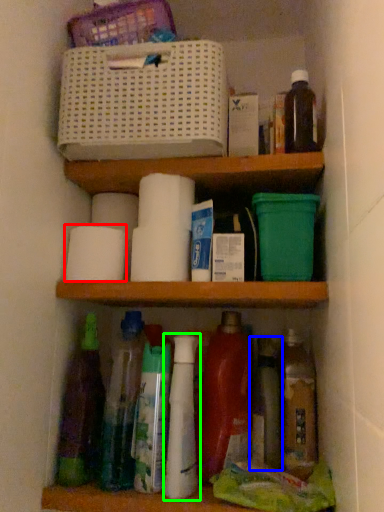
Question: Based on their relative distances, which object is nearer to toilet paper (highlighted by a red box)? Choose from bottle (highlighted by a blue box) and bottle (highlighted by a green box).

Choices:
 (A) bottle
 (B) bottle

Answer: (B)